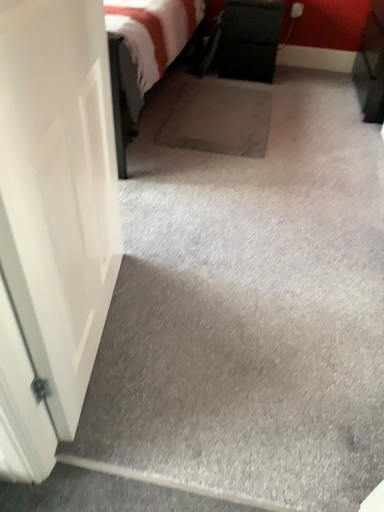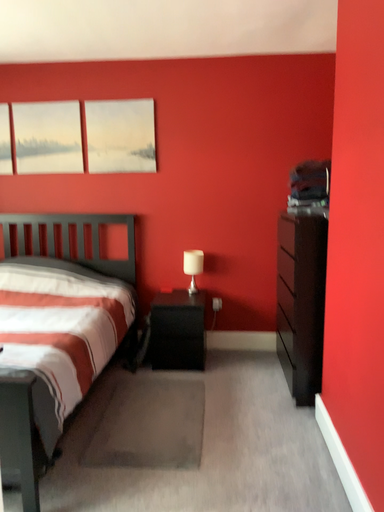
Question: How did the camera likely rotate when shooting the video?

Choices:
 (A) rotated upward
 (B) rotated downward

Answer: (A)